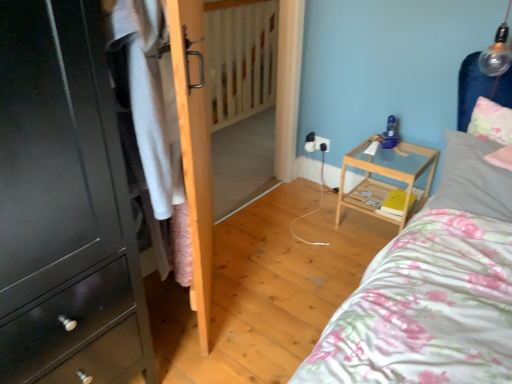
In order to click on vacant space in front of wooden door at left in this screenshot , I will do `click(224, 337)`.